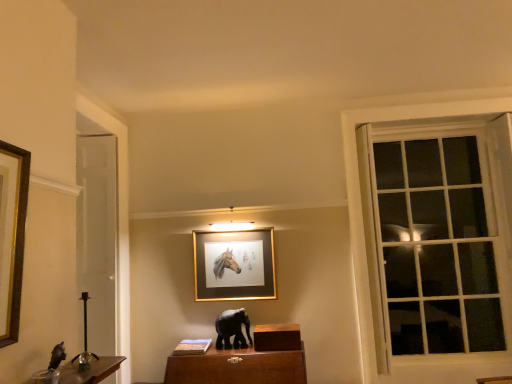
Question: Considering the relative sizes of shiny black elephant at left, the first animal from the left, and gold/metallic picture frame at center in the image provided, is shiny black elephant at left, the first animal from the left, wider than gold/metallic picture frame at center?

Choices:
 (A) no
 (B) yes

Answer: (B)

Question: Considering the relative sizes of shiny black elephant at left, the 1th animal in the top-to-bottom sequence, and gold/metallic picture frame at center in the image provided, is shiny black elephant at left, the 1th animal in the top-to-bottom sequence, taller than gold/metallic picture frame at center?

Choices:
 (A) yes
 (B) no

Answer: (B)

Question: Is shiny black elephant at left, the first animal from the left, in front of gold/metallic picture frame at center?

Choices:
 (A) yes
 (B) no

Answer: (A)

Question: From the image's perspective, is shiny black elephant at left, the first animal from the left, on top of gold/metallic picture frame at center?

Choices:
 (A) no
 (B) yes

Answer: (A)

Question: Does shiny black elephant at left, the 2th animal ordered from the bottom, have a lesser height compared to gold/metallic picture frame at center?

Choices:
 (A) no
 (B) yes

Answer: (B)

Question: Is shiny black elephant at left, the 1th animal from the front, wider or thinner than gold/metallic picture frame at center?

Choices:
 (A) thin
 (B) wide

Answer: (B)

Question: Relative to gold/metallic picture frame at center, is shiny black elephant at left, the 1th animal in the top-to-bottom sequence, in front or behind?

Choices:
 (A) behind
 (B) front

Answer: (B)

Question: In terms of size, does shiny black elephant at left, the 2th animal when ordered from right to left, appear bigger or smaller than gold/metallic picture frame at center?

Choices:
 (A) big
 (B) small

Answer: (B)

Question: From a real-world perspective, is shiny black elephant at left, positioned as the 2th animal in back-to-front order, positioned above or below gold/metallic picture frame at center?

Choices:
 (A) below
 (B) above

Answer: (A)

Question: From a real-world perspective, relative to shiny black elephant at left, the 1th animal from the front, is white glass window at right vertically above or below?

Choices:
 (A) below
 (B) above

Answer: (B)

Question: From the image's perspective, is white glass window at right above or below shiny black elephant at left, the 2th animal when ordered from right to left?

Choices:
 (A) above
 (B) below

Answer: (A)

Question: Would you say white glass window at right is to the left or to the right of shiny black elephant at left, positioned as the 2th animal in back-to-front order, in the picture?

Choices:
 (A) left
 (B) right

Answer: (B)

Question: In terms of height, does white glass window at right look taller or shorter compared to shiny black elephant at left, the 2th animal when ordered from right to left?

Choices:
 (A) short
 (B) tall

Answer: (B)

Question: Choose the correct answer: Is shiny black elephant at left, positioned as the 2th animal in back-to-front order, inside white glass window at right or outside it?

Choices:
 (A) inside
 (B) outside

Answer: (B)

Question: Considering the relative positions of shiny black elephant at left, the 1th animal in the top-to-bottom sequence, and white glass window at right in the image provided, is shiny black elephant at left, the 1th animal in the top-to-bottom sequence, to the left or to the right of white glass window at right?

Choices:
 (A) right
 (B) left

Answer: (B)